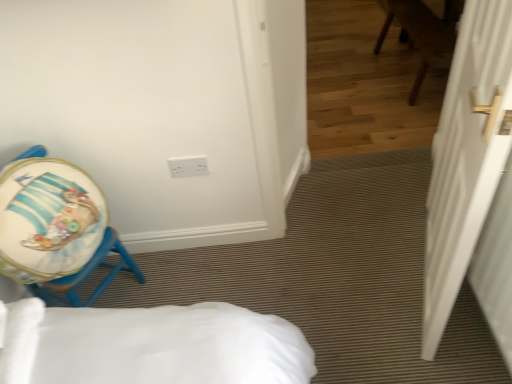
Question: From their relative heights in the image, would you say matte blue stool at left is taller or shorter than white matte door at right?

Choices:
 (A) tall
 (B) short

Answer: (B)

Question: Choose the correct answer: Is matte blue stool at left inside white matte door at right or outside it?

Choices:
 (A) inside
 (B) outside

Answer: (B)

Question: Estimate the real-world distances between objects in this image. Which object is farther from the matte blue stool at left?

Choices:
 (A) white matte door at right
 (B) white plastic electric outlet at upper center

Answer: (A)

Question: Which is nearer to the matte blue stool at left?

Choices:
 (A) white matte door at right
 (B) white plastic electric outlet at upper center

Answer: (B)